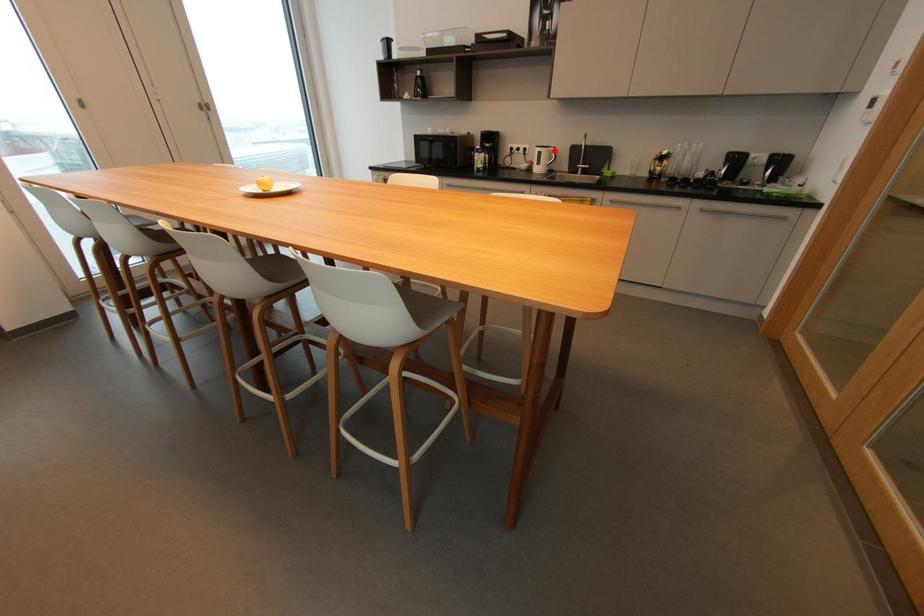
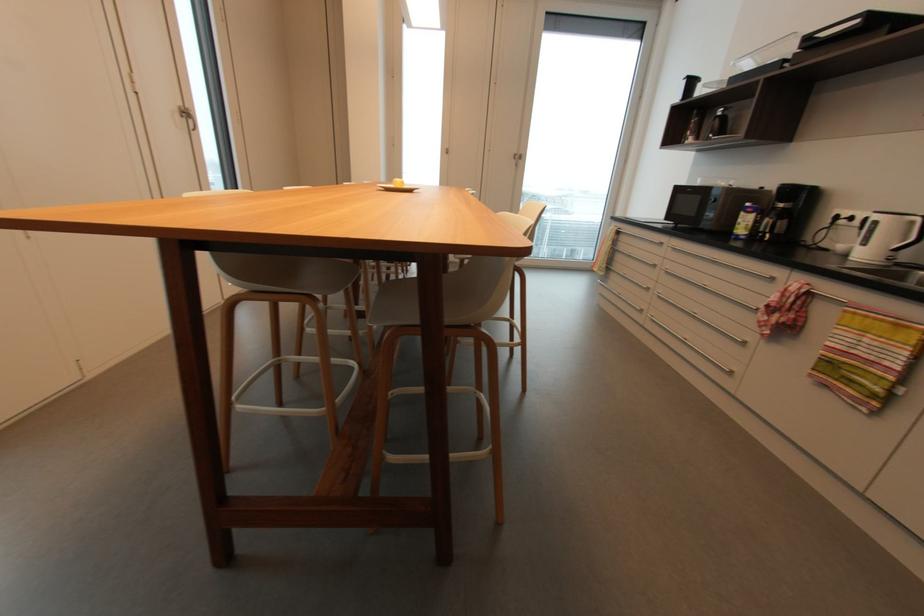
Question: I am providing you with two images of the same scene from different viewpoints. A red point is shown in image1. For the corresponding object point in image2, is it positioned nearer or farther from the camera?

Choices:
 (A) Nearer
 (B) Farther

Answer: (B)